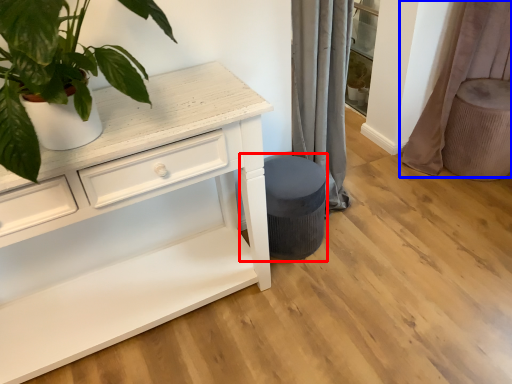
Question: Which of the following is the closest to the observer, music stool (highlighted by a red box) or curtain (highlighted by a blue box)?

Choices:
 (A) music stool
 (B) curtain

Answer: (A)